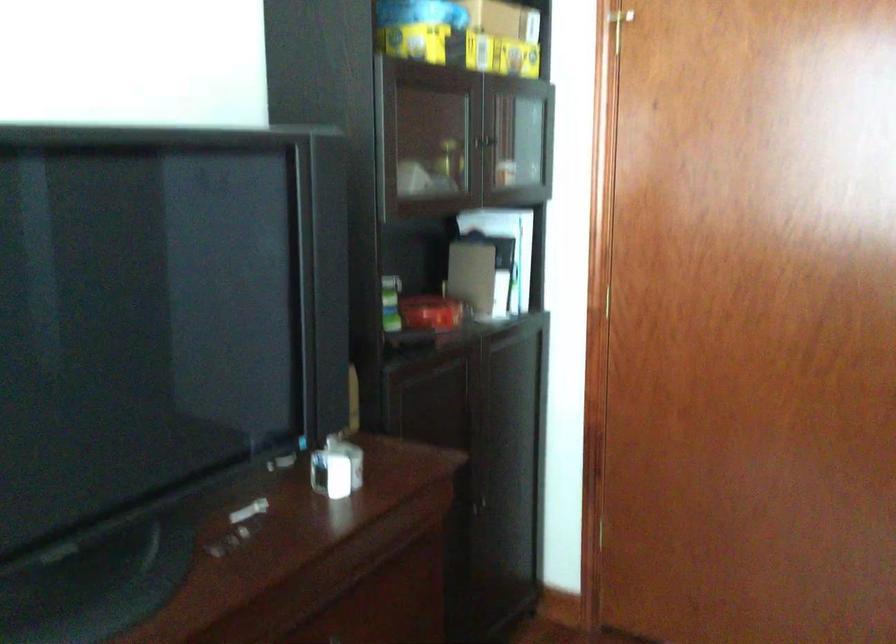
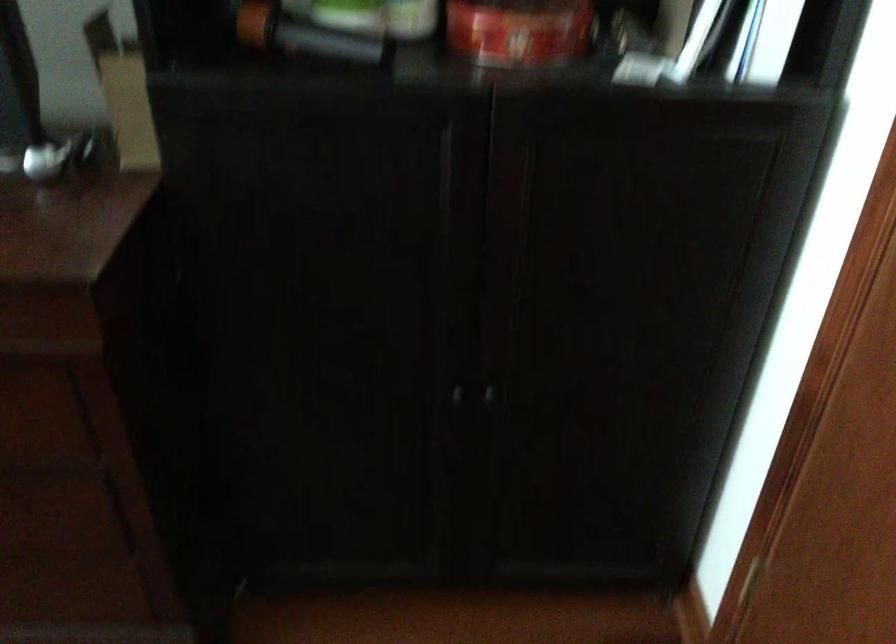
The point at (471, 516) is marked in the first image. Where is the corresponding point in the second image?

(457, 395)